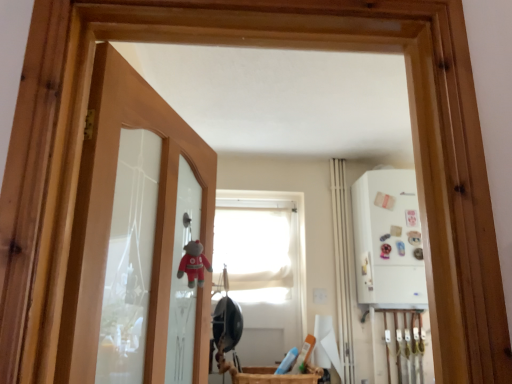
Question: Considering the relative sizes of white glossy medicine cabinet at right and white fabric curtain at center-right in the image provided, is white glossy medicine cabinet at right wider than white fabric curtain at center-right?

Choices:
 (A) yes
 (B) no

Answer: (A)

Question: Does white glossy medicine cabinet at right have a larger size compared to white fabric curtain at center-right?

Choices:
 (A) yes
 (B) no

Answer: (A)

Question: Is white glossy medicine cabinet at right positioned in front of white fabric curtain at center-right?

Choices:
 (A) no
 (B) yes

Answer: (B)

Question: Are white glossy medicine cabinet at right and white fabric curtain at center-right making contact?

Choices:
 (A) yes
 (B) no

Answer: (B)

Question: Is white glossy medicine cabinet at right turned away from white fabric curtain at center-right?

Choices:
 (A) yes
 (B) no

Answer: (B)

Question: Is translucent glass door at left to the left or to the right of white glossy medicine cabinet at right in the image?

Choices:
 (A) right
 (B) left

Answer: (B)

Question: Choose the correct answer: Is translucent glass door at left inside white glossy medicine cabinet at right or outside it?

Choices:
 (A) outside
 (B) inside

Answer: (A)

Question: Does point (168, 274) appear closer or farther from the camera than point (378, 193)?

Choices:
 (A) farther
 (B) closer

Answer: (B)

Question: In terms of height, does translucent glass door at left look taller or shorter compared to white glossy medicine cabinet at right?

Choices:
 (A) tall
 (B) short

Answer: (A)

Question: Is translucent glass door at left spatially inside white matte window at center, or outside of it?

Choices:
 (A) inside
 (B) outside

Answer: (B)

Question: From the image's perspective, is translucent glass door at left located above or below white matte window at center?

Choices:
 (A) above
 (B) below

Answer: (A)

Question: Considering the relative positions of translucent glass door at left and white matte window at center in the image provided, is translucent glass door at left to the left or to the right of white matte window at center?

Choices:
 (A) left
 (B) right

Answer: (A)

Question: Considering the positions of point (144, 92) and point (285, 261), is point (144, 92) closer or farther from the camera than point (285, 261)?

Choices:
 (A) closer
 (B) farther

Answer: (A)

Question: Considering the relative positions of white fabric curtain at center-right and white matte window at center in the image provided, is white fabric curtain at center-right to the left or to the right of white matte window at center?

Choices:
 (A) left
 (B) right

Answer: (B)

Question: From a real-world perspective, is white fabric curtain at center-right above or below white matte window at center?

Choices:
 (A) below
 (B) above

Answer: (B)